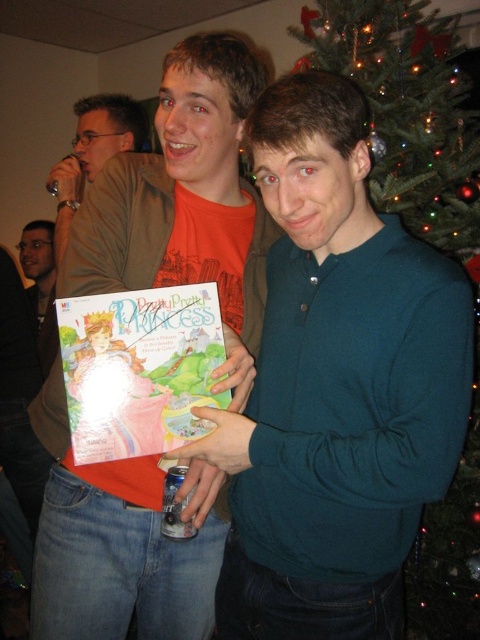
Question: Can you confirm if matte orange shirt at center is positioned below green artificial christmas tree at upper right?

Choices:
 (A) yes
 (B) no

Answer: (A)

Question: Can you confirm if green artificial christmas tree at upper right is bigger than matte khaki shirt at left?

Choices:
 (A) yes
 (B) no

Answer: (A)

Question: Which is nearer to the matte black face at left?

Choices:
 (A) matte orange shirt at center
 (B) green artificial christmas tree at upper right

Answer: (B)

Question: Is matte orange shirt at center positioned at the back of matte khaki shirt at left?

Choices:
 (A) yes
 (B) no

Answer: (B)

Question: Which point appears closest to the camera in this image?

Choices:
 (A) (132, 131)
 (B) (415, 552)

Answer: (B)

Question: Among these objects, which one is farthest from the camera?

Choices:
 (A) matte black face at left
 (B) green artificial christmas tree at upper right
 (C) matte orange shirt at center

Answer: (A)